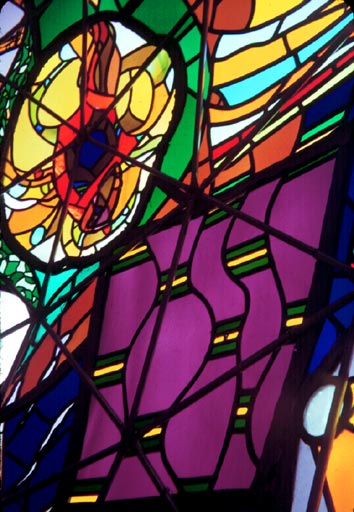
This screenshot has height=512, width=354. Find the location of `stain glass artwork`. stain glass artwork is located at coordinates (196, 262).